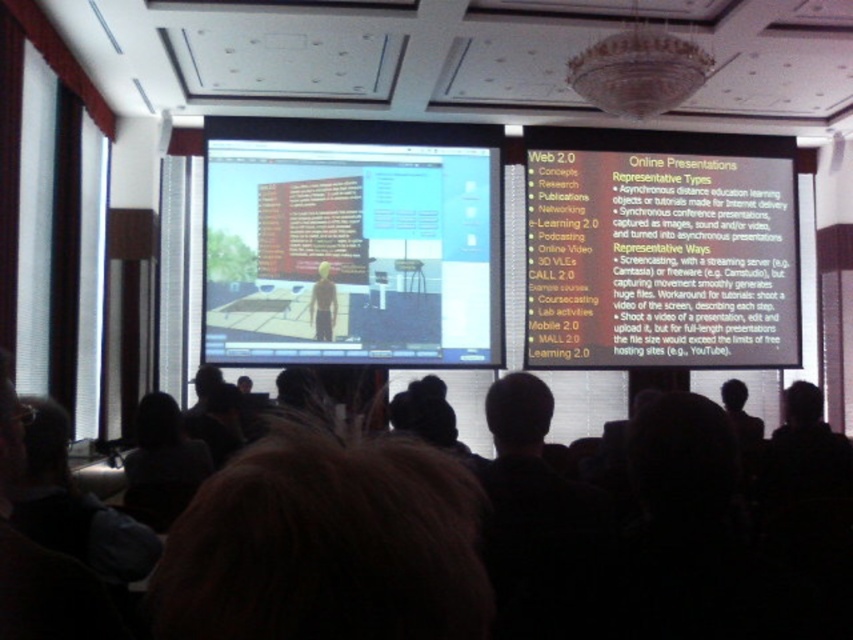
Question: Does dark hair at center appear over brown hair at center?

Choices:
 (A) no
 (B) yes

Answer: (A)

Question: From the image, what is the correct spatial relationship of brown hair at center in relation to dark gray sweater at lower left?

Choices:
 (A) right
 (B) left

Answer: (A)

Question: Does matte plastic computer monitor at center appear on the left side of dark gray sweater at lower left?

Choices:
 (A) yes
 (B) no

Answer: (B)

Question: Which object appears farthest from the camera in this image?

Choices:
 (A) matte plastic computer monitor at center
 (B) white paper at upper right

Answer: (B)

Question: Which point appears farthest from the camera in this image?

Choices:
 (A) click(x=398, y=358)
 (B) click(x=129, y=524)
 (C) click(x=668, y=492)

Answer: (A)

Question: Estimate the real-world distances between objects in this image. Which object is farther from the dark gray sweater at lower left?

Choices:
 (A) light brown fabric shirt at center
 (B) white paper at upper right
 (C) brown hair at center

Answer: (B)